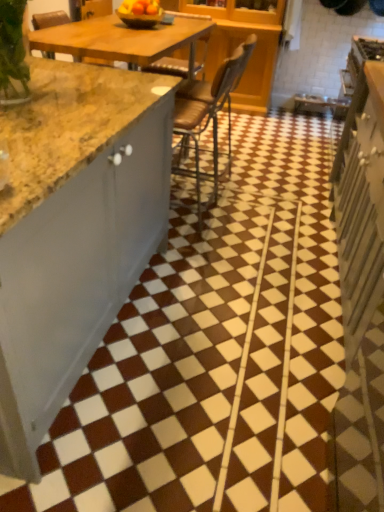
The image size is (384, 512). I want to click on vacant region under brown leather chair at center (from a real-world perspective), so click(x=211, y=180).